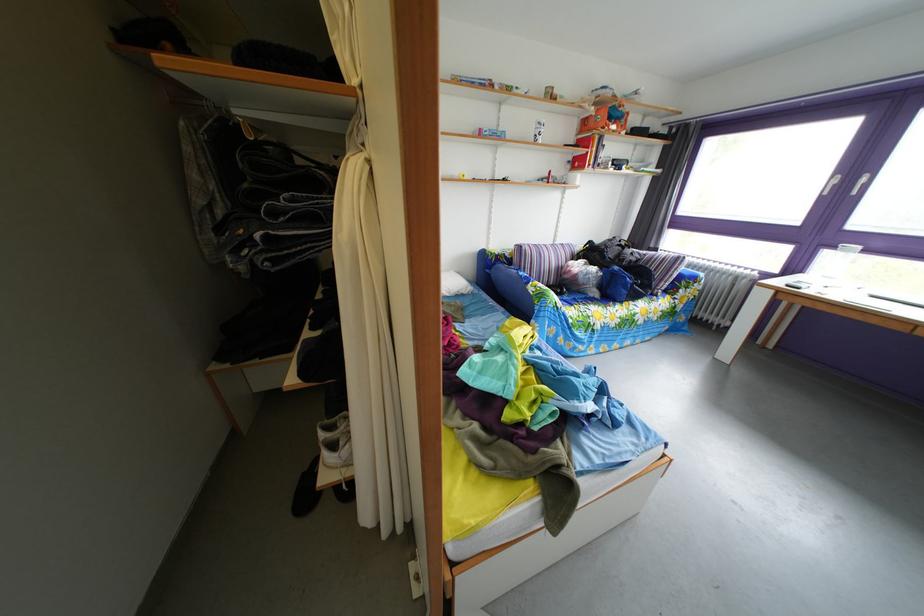
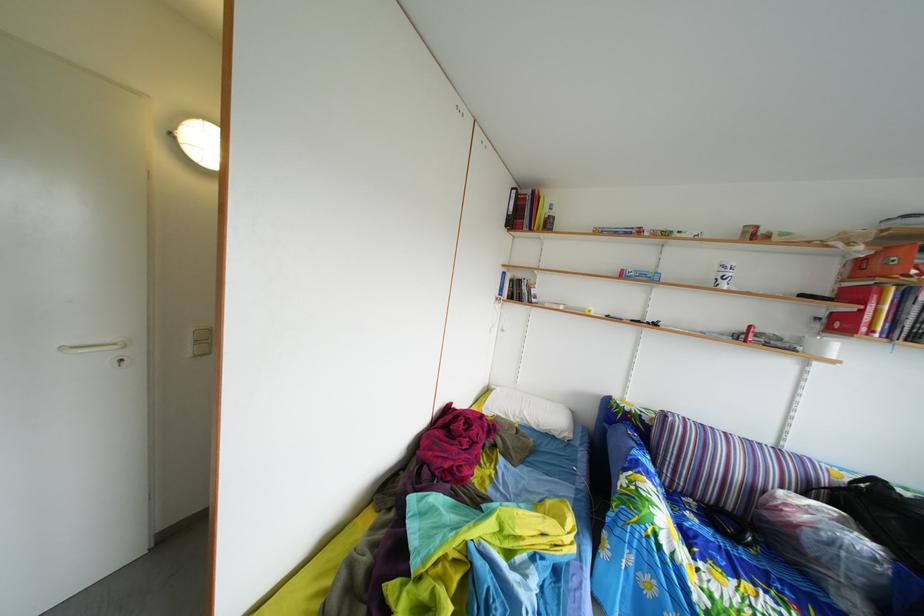
In the second image, find the point that corresponds to (562,292) in the first image.

(739, 516)